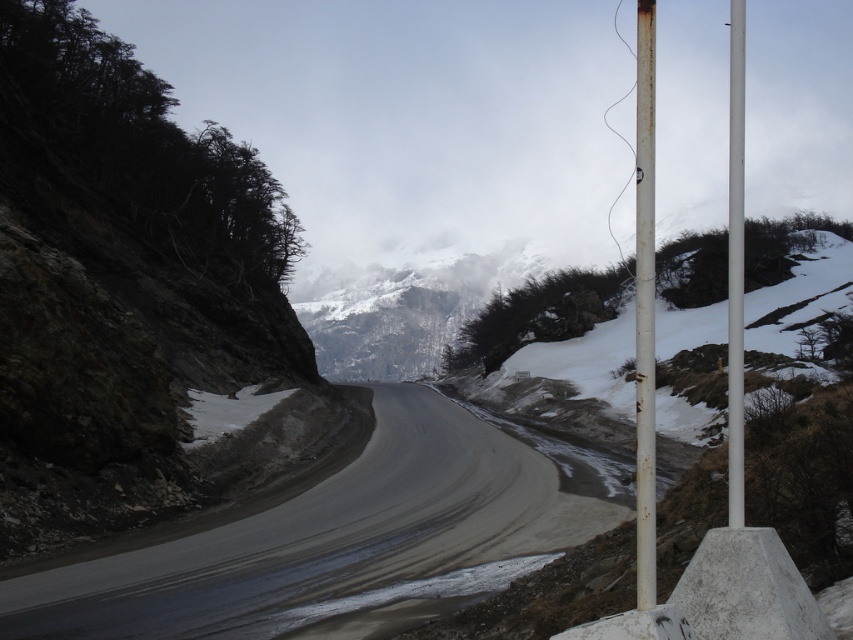
The height and width of the screenshot is (640, 853). What do you see at coordinates (643, 307) in the screenshot? I see `rusty metal pole at right` at bounding box center [643, 307].

Does point (650, 369) lie in front of point (740, 77)?

Yes, point (650, 369) is closer to viewer.

Find the location of a particular element. This screenshot has width=853, height=640. rusty metal pole at right is located at coordinates (643, 307).

The width and height of the screenshot is (853, 640). Find the location of `rusty metal pole at right`. rusty metal pole at right is located at coordinates (643, 307).

Consider the image. Does smooth asphalt road at center appear on the right side of rusty metal pole at center-right?

Incorrect, smooth asphalt road at center is not on the right side of rusty metal pole at center-right.

Who is positioned more to the right, smooth asphalt road at center or rusty metal pole at center-right?

rusty metal pole at center-right

Locate an element on the screen. The image size is (853, 640). smooth asphalt road at center is located at coordinates (335, 544).

Describe the element at coordinates (335, 544) in the screenshot. I see `smooth asphalt road at center` at that location.

Where is `smooth asphalt road at center`? smooth asphalt road at center is located at coordinates (335, 544).